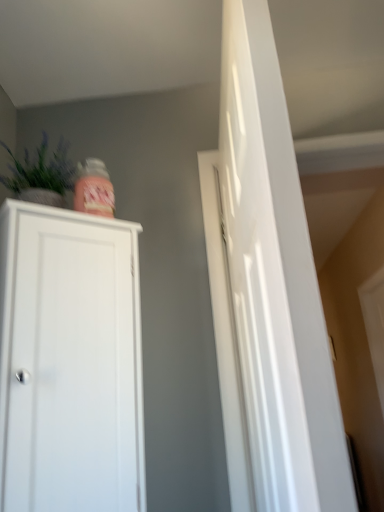
Question: Can you confirm if green matte vase at upper left is thinner than glossy white door at right?

Choices:
 (A) no
 (B) yes

Answer: (A)

Question: Is green matte vase at upper left not within glossy white door at right?

Choices:
 (A) no
 (B) yes

Answer: (B)

Question: Does green matte vase at upper left have a lesser height compared to glossy white door at right?

Choices:
 (A) no
 (B) yes

Answer: (B)

Question: Are green matte vase at upper left and glossy white door at right far apart?

Choices:
 (A) yes
 (B) no

Answer: (B)

Question: Is the depth of green matte vase at upper left less than that of glossy white door at right?

Choices:
 (A) no
 (B) yes

Answer: (A)

Question: Considering their positions, is glossy white door at right located in front of or behind green matte vase at upper left?

Choices:
 (A) front
 (B) behind

Answer: (A)

Question: Is glossy white door at right situated inside green matte vase at upper left or outside?

Choices:
 (A) outside
 (B) inside

Answer: (A)

Question: From their relative heights in the image, would you say glossy white door at right is taller or shorter than green matte vase at upper left?

Choices:
 (A) tall
 (B) short

Answer: (A)

Question: Looking at their shapes, would you say glossy white door at right is wider or thinner than green matte vase at upper left?

Choices:
 (A) thin
 (B) wide

Answer: (A)

Question: Based on their positions, is white matte cabinet at left located to the left or right of green matte vase at upper left?

Choices:
 (A) left
 (B) right

Answer: (B)

Question: Based on their sizes in the image, would you say white matte cabinet at left is bigger or smaller than green matte vase at upper left?

Choices:
 (A) big
 (B) small

Answer: (A)

Question: From a real-world perspective, is white matte cabinet at left positioned above or below green matte vase at upper left?

Choices:
 (A) below
 (B) above

Answer: (A)

Question: From their relative heights in the image, would you say white matte cabinet at left is taller or shorter than green matte vase at upper left?

Choices:
 (A) tall
 (B) short

Answer: (A)

Question: From the image's perspective, is white matte cabinet at left positioned above or below glossy white door at right?

Choices:
 (A) above
 (B) below

Answer: (B)

Question: Considering the positions of point (29, 243) and point (261, 99), is point (29, 243) closer or farther from the camera than point (261, 99)?

Choices:
 (A) farther
 (B) closer

Answer: (A)